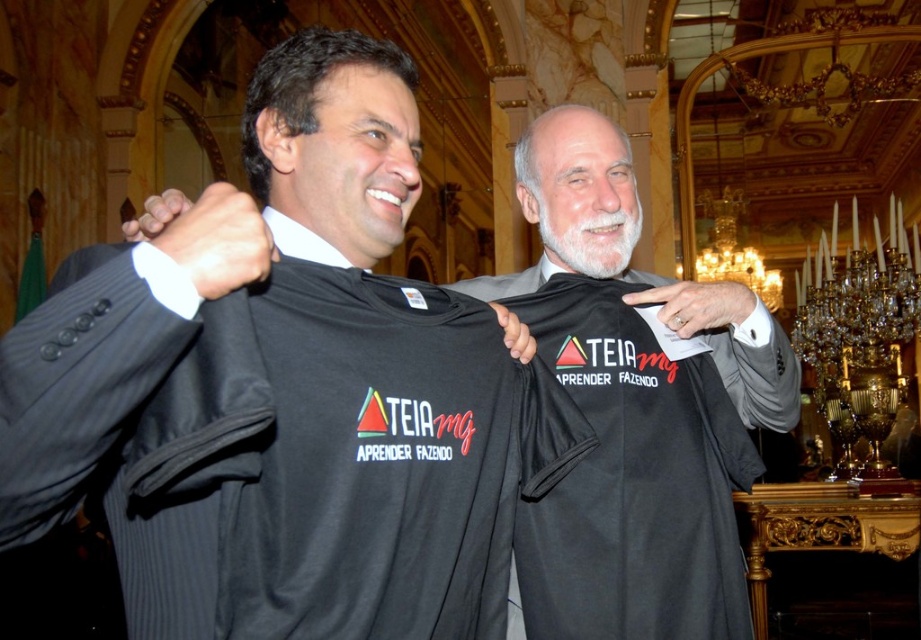
Which is more to the right, black fabric shirt at center or black matte shirt at center?

From the viewer's perspective, black matte shirt at center appears more on the right side.

Does black fabric shirt at center have a lesser height compared to black matte shirt at center?

No.

Where is `black fabric shirt at center`? The image size is (921, 640). black fabric shirt at center is located at coordinates (630, 259).